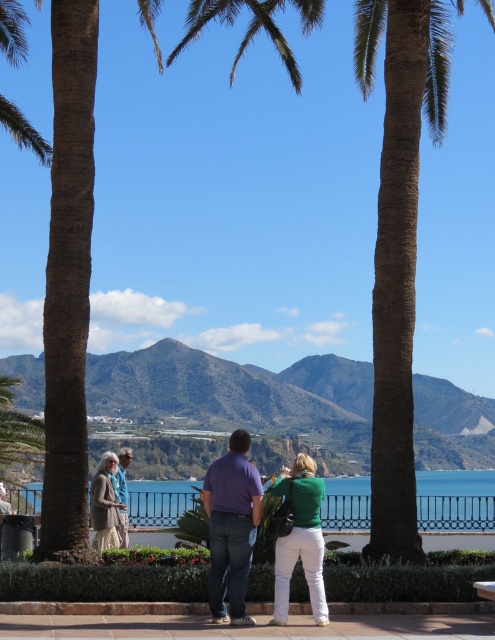
Question: Considering the real-world distances, which object is farthest from the blue water at center?

Choices:
 (A) blue denim jeans at center
 (B) purple cotton shirt at center
 (C) green matte shirt at center

Answer: (B)

Question: Which of the following is the closest to the observer?

Choices:
 (A) purple cotton shirt at center
 (B) blue denim jeans at center

Answer: (A)

Question: Is purple cotton shirt at center closer to camera compared to green matte shirt at center?

Choices:
 (A) yes
 (B) no

Answer: (A)

Question: Can you confirm if blue water at center is bigger than blue denim jeans at center?

Choices:
 (A) yes
 (B) no

Answer: (A)

Question: Where is green matte shirt at center located in relation to blue denim jeans at center in the image?

Choices:
 (A) below
 (B) above

Answer: (B)

Question: Which point is closer to the camera?

Choices:
 (A) (318, 620)
 (B) (438, 486)
 (C) (125, 486)
 (D) (310, 595)

Answer: (A)